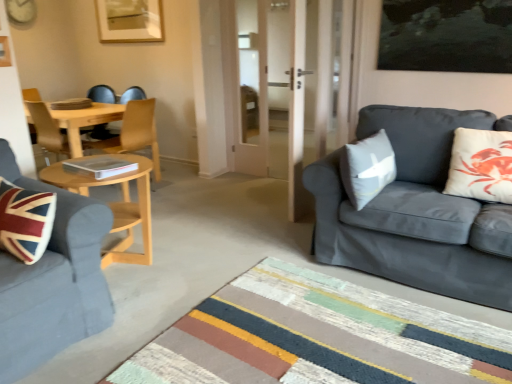
Find the location of a particular element. This screenshot has width=512, height=384. gray fabric pillow at right, the 2th pillow when ordered from right to left is located at coordinates (367, 168).

Measure the distance between point (151, 166) and camera.

The distance of point (151, 166) from camera is 8.35 feet.

Find the location of a particular element. The image size is (512, 384). striped rug at center is located at coordinates (318, 337).

The image size is (512, 384). What do you see at coordinates (416, 213) in the screenshot? I see `dark gray fabric couch at right, the 1th studio couch positioned from the right` at bounding box center [416, 213].

I want to click on dark gray fabric couch at right, the 1th studio couch positioned from the right, so click(x=416, y=213).

The width and height of the screenshot is (512, 384). Find the location of `velvet blue sofa at left, placed as the second studio couch when sorted from right to left`. velvet blue sofa at left, placed as the second studio couch when sorted from right to left is located at coordinates (53, 281).

Describe the element at coordinates (481, 165) in the screenshot. This screenshot has height=384, width=512. I see `white matte cushion at right, placed as the 1th pillow when sorted from right to left` at that location.

What are the coordinates of `gray fabric pillow at right, which is counted as the first pillow, starting from the left` in the screenshot? It's located at (367, 168).

Would you say striped rug at center is a long distance from light wood coffee table at center left?

Absolutely, striped rug at center is distant from light wood coffee table at center left.

Considering the sizes of objects striped rug at center and light wood coffee table at center left in the image provided, who is taller, striped rug at center or light wood coffee table at center left?

Standing taller between the two is light wood coffee table at center left.

From the image's perspective, who appears lower, striped rug at center or light wood coffee table at center left?

striped rug at center is shown below in the image.

In the scene shown: Measure the distance between striped rug at center and light wood coffee table at center left.

The distance of striped rug at center from light wood coffee table at center left is 1.08 meters.

Is light wood coffee table at center left completely or partially inside white matte cushion at right, placed as the 1th pillow when sorted from right to left?

No.

Does white matte cushion at right, placed as the 1th pillow when sorted from right to left, have a greater height compared to light wood coffee table at center left?

No.

Considering the relative sizes of white matte cushion at right, placed as the 1th pillow when sorted from right to left, and light wood coffee table at center left in the image provided, is white matte cushion at right, placed as the 1th pillow when sorted from right to left, wider than light wood coffee table at center left?

Incorrect, the width of white matte cushion at right, placed as the 1th pillow when sorted from right to left, does not surpass that of light wood coffee table at center left.

Is white matte cushion at right, placed as the 1th pillow when sorted from right to left, to the left of light wood coffee table at center left from the viewer's perspective?

No.

Is gray fabric pillow at right, which is counted as the first pillow, starting from the left, in front of matte gold picture frame at upper center?

Yes, gray fabric pillow at right, which is counted as the first pillow, starting from the left, is in front of matte gold picture frame at upper center.

From a real-world perspective, who is located lower, gray fabric pillow at right, the 2th pillow when ordered from right to left, or matte gold picture frame at upper center?

gray fabric pillow at right, the 2th pillow when ordered from right to left, is physically lower.

Can you confirm if gray fabric pillow at right, the 2th pillow when ordered from right to left, is shorter than matte gold picture frame at upper center?

Yes, gray fabric pillow at right, the 2th pillow when ordered from right to left, is shorter than matte gold picture frame at upper center.

Is gray fabric pillow at right, the 2th pillow when ordered from right to left, bigger or smaller than matte gold picture frame at upper center?

Clearly, gray fabric pillow at right, the 2th pillow when ordered from right to left, is larger in size than matte gold picture frame at upper center.

From the image's perspective, is velvet blue sofa at left, placed as the second studio couch when sorted from right to left, on gray fabric pillow at right, the 2th pillow when ordered from right to left?

No, from the image's perspective, velvet blue sofa at left, placed as the second studio couch when sorted from right to left, is not above gray fabric pillow at right, the 2th pillow when ordered from right to left.

Considering the relative positions of velvet blue sofa at left, the 1th studio couch from the left, and gray fabric pillow at right, which is counted as the first pillow, starting from the left, in the image provided, is velvet blue sofa at left, the 1th studio couch from the left, to the left of gray fabric pillow at right, which is counted as the first pillow, starting from the left, from the viewer's perspective?

Yes.

Between velvet blue sofa at left, the 1th studio couch from the left, and gray fabric pillow at right, which is counted as the first pillow, starting from the left, which one is positioned in front?

Positioned in front is velvet blue sofa at left, the 1th studio couch from the left.

Is velvet blue sofa at left, the 1th studio couch from the left, facing towards dark gray fabric couch at right, which appears as the 2th studio couch when viewed from the left?

No, velvet blue sofa at left, the 1th studio couch from the left, is not aimed at dark gray fabric couch at right, which appears as the 2th studio couch when viewed from the left.

Is velvet blue sofa at left, the 1th studio couch from the left, smaller than dark gray fabric couch at right, the 1th studio couch positioned from the right?

Correct, velvet blue sofa at left, the 1th studio couch from the left, occupies less space than dark gray fabric couch at right, the 1th studio couch positioned from the right.

In terms of height, does velvet blue sofa at left, the 1th studio couch from the left, look taller or shorter compared to dark gray fabric couch at right, which appears as the 2th studio couch when viewed from the left?

velvet blue sofa at left, the 1th studio couch from the left, is taller than dark gray fabric couch at right, which appears as the 2th studio couch when viewed from the left.

The image size is (512, 384). In order to click on studio couch on the right of velvet blue sofa at left, the 1th studio couch from the left in this screenshot , I will do `click(416, 213)`.

Is white matte cushion at right, acting as the second pillow starting from the left, taller or shorter than striped rug at center?

In the image, white matte cushion at right, acting as the second pillow starting from the left, appears to be taller than striped rug at center.

Considering the sizes of objects white matte cushion at right, placed as the 1th pillow when sorted from right to left, and striped rug at center in the image provided, who is thinner, white matte cushion at right, placed as the 1th pillow when sorted from right to left, or striped rug at center?

white matte cushion at right, placed as the 1th pillow when sorted from right to left, is thinner.

Is the depth of white matte cushion at right, placed as the 1th pillow when sorted from right to left, less than that of striped rug at center?

No, white matte cushion at right, placed as the 1th pillow when sorted from right to left, is further to the viewer.

In terms of size, does white matte cushion at right, acting as the second pillow starting from the left, appear bigger or smaller than striped rug at center?

In the image, white matte cushion at right, acting as the second pillow starting from the left, appears to be smaller than striped rug at center.

Who is smaller, matte gold picture frame at upper center or light wood coffee table at center left?

With smaller size is matte gold picture frame at upper center.

What are the coordinates of `picture frame above the light wood coffee table at center left (from a real-world perspective)` in the screenshot? It's located at (130, 21).

Is matte gold picture frame at upper center located outside light wood coffee table at center left?

Yes, matte gold picture frame at upper center is located beyond the bounds of light wood coffee table at center left.

Is point (100, 1) positioned behind point (132, 220)?

Yes.

You are a GUI agent. You are given a task and a screenshot of the screen. Output one action in this format:
    pyautogui.click(x=<x>, y=<y>)
    Task: Click on the plain in front of the light wood coffee table at center left
    The width and height of the screenshot is (512, 384).
    Given the screenshot: What is the action you would take?
    pyautogui.click(x=318, y=337)

This screenshot has width=512, height=384. What are the coordinates of `the 2nd pillow above the light wood coffee table at center left (from a real-world perspective)` in the screenshot? It's located at (481, 165).

Estimate the real-world distances between objects in this image. Which object is further from gray fabric pillow at right, the 2th pillow when ordered from right to left, striped rug at center or white matte cushion at right, acting as the second pillow starting from the left?

Based on the image, striped rug at center appears to be further to gray fabric pillow at right, the 2th pillow when ordered from right to left.

Which object lies further to the anchor point white matte cushion at right, placed as the 1th pillow when sorted from right to left, velvet blue sofa at left, placed as the second studio couch when sorted from right to left, or striped rug at center?

The object further to white matte cushion at right, placed as the 1th pillow when sorted from right to left, is velvet blue sofa at left, placed as the second studio couch when sorted from right to left.

Estimate the real-world distances between objects in this image. Which object is closer to dark gray fabric couch at right, the 1th studio couch positioned from the right, light wood coffee table at center left or striped rug at center?

striped rug at center lies closer to dark gray fabric couch at right, the 1th studio couch positioned from the right, than the other object.

Which object lies nearer to the anchor point gray fabric pillow at right, which is counted as the first pillow, starting from the left, velvet blue sofa at left, the 1th studio couch from the left, or white matte cushion at right, placed as the 1th pillow when sorted from right to left?

white matte cushion at right, placed as the 1th pillow when sorted from right to left, lies closer to gray fabric pillow at right, which is counted as the first pillow, starting from the left, than the other object.

From the image, which object appears to be farther from striped rug at center, velvet blue sofa at left, the 1th studio couch from the left, or light wood coffee table at center left?

Based on the image, light wood coffee table at center left appears to be further to striped rug at center.

Estimate the real-world distances between objects in this image. Which object is closer to wooden chair at center, velvet blue sofa at left, the 1th studio couch from the left, or dark gray fabric couch at right, the 1th studio couch positioned from the right?

A: velvet blue sofa at left, the 1th studio couch from the left, lies closer to wooden chair at center than the other object.

Estimate the real-world distances between objects in this image. Which object is further from gray fabric pillow at right, which is counted as the first pillow, starting from the left, light wood coffee table at center left or dark gray fabric couch at right, which appears as the 2th studio couch when viewed from the left?

The object further to gray fabric pillow at right, which is counted as the first pillow, starting from the left, is light wood coffee table at center left.

From the image, which object appears to be nearer to wooden chair at center, dark gray fabric couch at right, which appears as the 2th studio couch when viewed from the left, or white matte cushion at right, acting as the second pillow starting from the left?

dark gray fabric couch at right, which appears as the 2th studio couch when viewed from the left.

Locate an element on the screen. The height and width of the screenshot is (384, 512). pillow between light wood coffee table at center left and white matte cushion at right, placed as the 1th pillow when sorted from right to left is located at coordinates (367, 168).

The width and height of the screenshot is (512, 384). In order to click on plain between light wood coffee table at center left and gray fabric pillow at right, the 2th pillow when ordered from right to left, in the horizontal direction in this screenshot , I will do `click(318, 337)`.

Locate an element on the screen. The height and width of the screenshot is (384, 512). coffee table between striped rug at center and wooden chair at center in the front-back direction is located at coordinates point(116,205).

Find the location of a particular element. Image resolution: width=512 pixels, height=384 pixels. pillow between light wood coffee table at center left and dark gray fabric couch at right, which appears as the 2th studio couch when viewed from the left, from left to right is located at coordinates (367, 168).